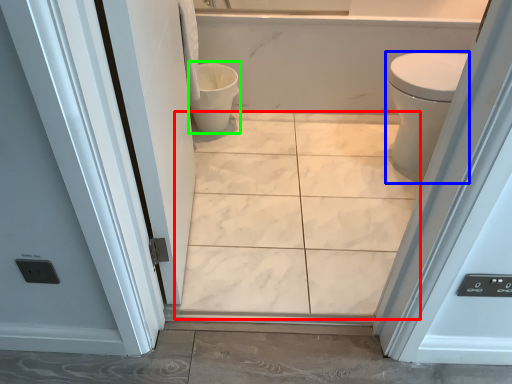
Question: Which object is the farthest from ceramic tile (highlighted by a red box)? Choose among these: bidet (highlighted by a blue box) or toilet bowl (highlighted by a green box).

Choices:
 (A) bidet
 (B) toilet bowl

Answer: (B)